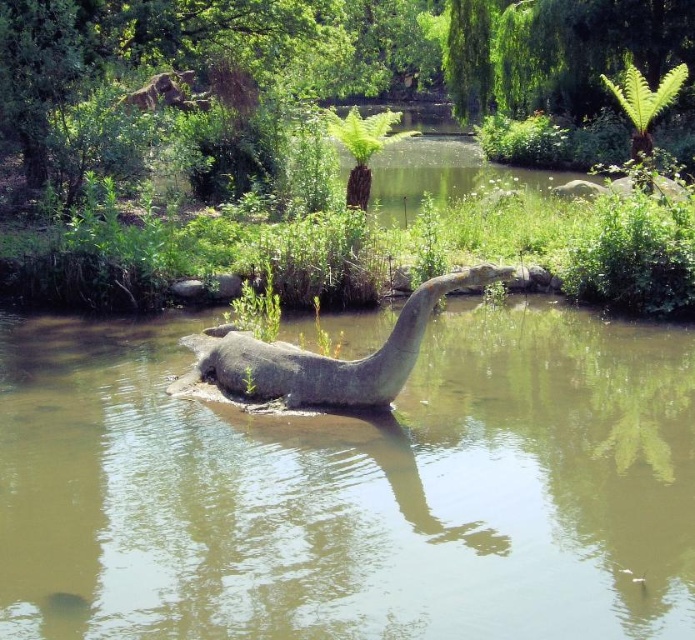
Question: Is greenish-brown water at center closer to camera compared to gray stone statue at center?

Choices:
 (A) yes
 (B) no

Answer: (A)

Question: Can you confirm if greenish-brown water at center is thinner than gray stone statue at center?

Choices:
 (A) no
 (B) yes

Answer: (A)

Question: Which point is farther to the camera?

Choices:
 (A) greenish-brown water at center
 (B) gray stone statue at center

Answer: (B)

Question: Which point is farther to the camera?

Choices:
 (A) greenish-brown water at center
 (B) gray stone statue at center

Answer: (B)

Question: Is greenish-brown water at center bigger than gray stone statue at center?

Choices:
 (A) yes
 (B) no

Answer: (A)